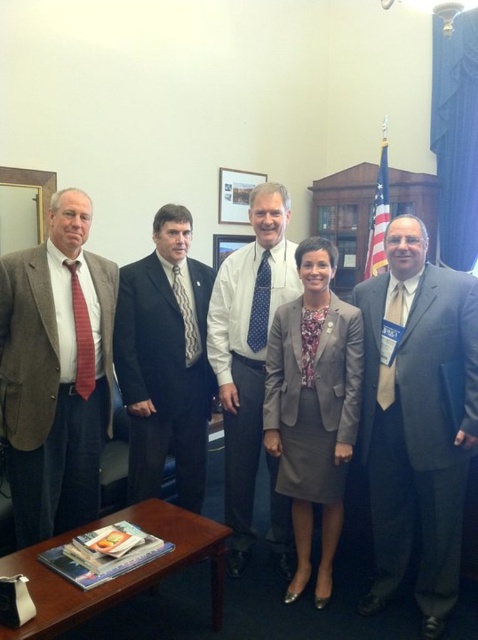
You are standing in the room and see two points marked in the image. The first point is at coordinates point (315,401) and the second point is at point (173,401). Which point is closer to you?

Point (315,401) is in front of point (173,401), so it is closer to you.

How far apart are the two people standing at the coordinates point [319,378] and point 0.408, 0.331?

The two people standing at the coordinates point [319,378] and point 0.408, 0.331 are 8.33 feet apart.

You are standing in the office scene described. You need to locate the matte brown suit at left. According to the coordinates provided, where should you look first?

The matte brown suit at left is located at coordinates point [55,371].